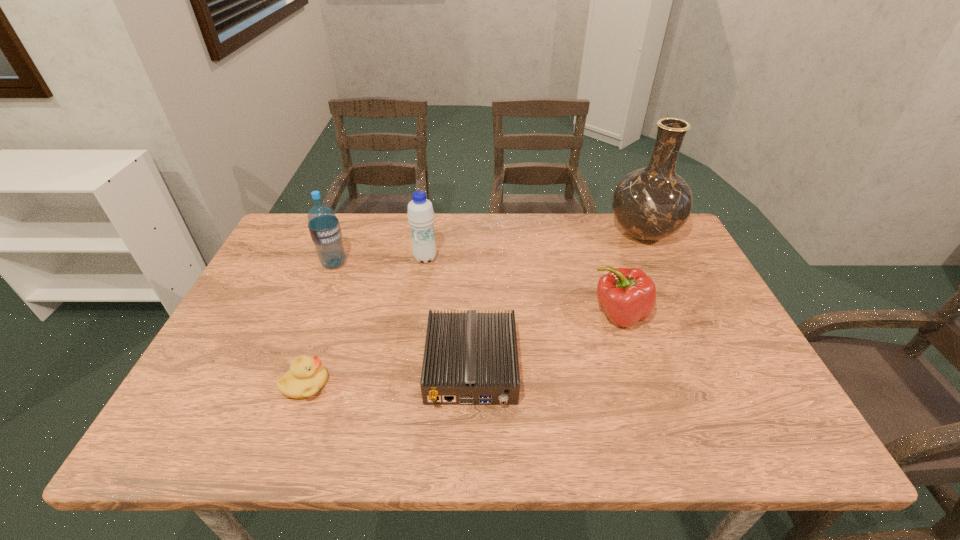
Where is `the tallest object`? The image size is (960, 540). the tallest object is located at coordinates (651, 203).

Locate an element on the screen. the left water bottle is located at coordinates (324, 227).

This screenshot has height=540, width=960. In order to click on the right water bottle in this screenshot , I will do `click(420, 215)`.

Locate an element on the screen. The width and height of the screenshot is (960, 540). the third shortest object is located at coordinates (627, 296).

You are a GUI agent. You are given a task and a screenshot of the screen. Output one action in this format:
    pyautogui.click(x=<x>, y=<y>)
    Task: Click on the duckling
    The width and height of the screenshot is (960, 540).
    Given the screenshot: What is the action you would take?
    pyautogui.click(x=306, y=376)

Locate an element on the screen. router is located at coordinates (471, 358).

The width and height of the screenshot is (960, 540). In order to click on free location located 0.360m on the left of the vase in this screenshot , I will do `click(492, 233)`.

This screenshot has height=540, width=960. I want to click on vacant space located on the right of the left water bottle, so click(x=469, y=264).

Find the location of a particular element. The image size is (960, 540). vacant space located 0.270m on the right of the right water bottle is located at coordinates (530, 258).

You are a GUI agent. You are given a task and a screenshot of the screen. Output one action in this format:
    pyautogui.click(x=<x>, y=<y>)
    Task: Click on the vacant space located 0.190m on the left of the pepper
    The height and width of the screenshot is (540, 960).
    Given the screenshot: What is the action you would take?
    pyautogui.click(x=516, y=314)